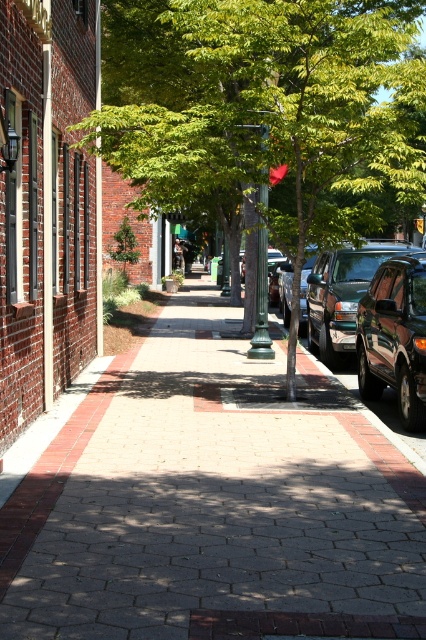
Question: Which point appears farthest from the camera in this image?

Choices:
 (A) (321, 280)
 (B) (166, 109)
 (C) (271, 360)

Answer: (A)

Question: Which of the following is the closest to the observer?

Choices:
 (A) green leafy tree at center
 (B) brick pavement at center
 (C) metallic dark gray suv at right
 (D) shiny dark green suv at right

Answer: (B)

Question: Does green leafy tree at center appear under metallic dark gray suv at right?

Choices:
 (A) yes
 (B) no

Answer: (B)

Question: Which is farther from the metallic dark gray suv at right?

Choices:
 (A) green leafy tree at center
 (B) shiny dark green suv at right

Answer: (A)

Question: Is brick pavement at center further to the viewer compared to green leafy tree at center?

Choices:
 (A) yes
 (B) no

Answer: (B)

Question: Does brick pavement at center have a lesser width compared to green leafy tree at center?

Choices:
 (A) no
 (B) yes

Answer: (B)